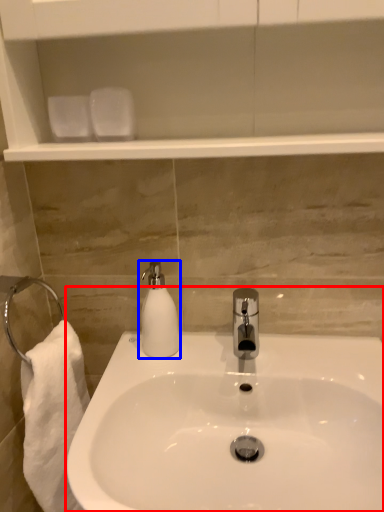
Question: Which object appears farthest to the camera in this image, sink (highlighted by a red box) or soap dispenser (highlighted by a blue box)?

Choices:
 (A) sink
 (B) soap dispenser

Answer: (B)